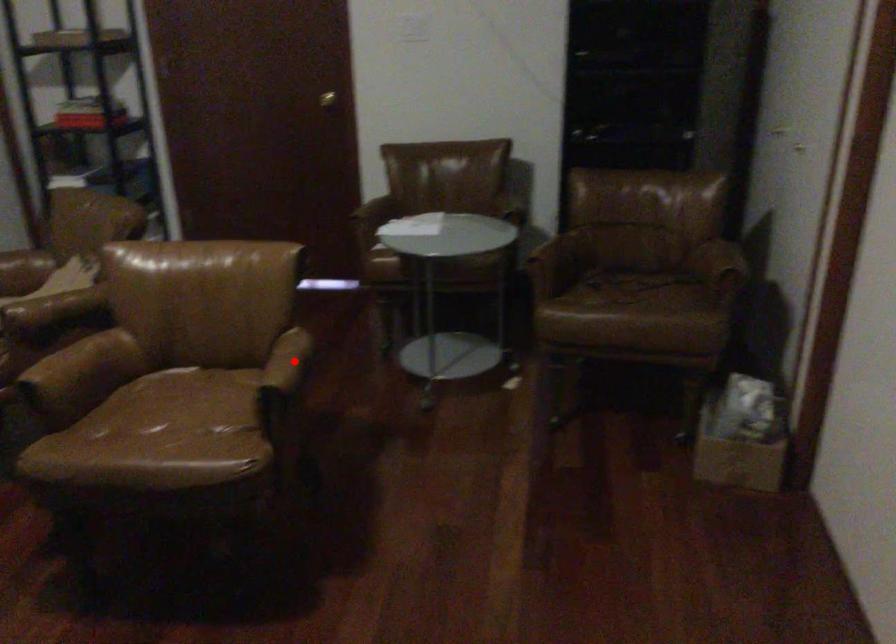
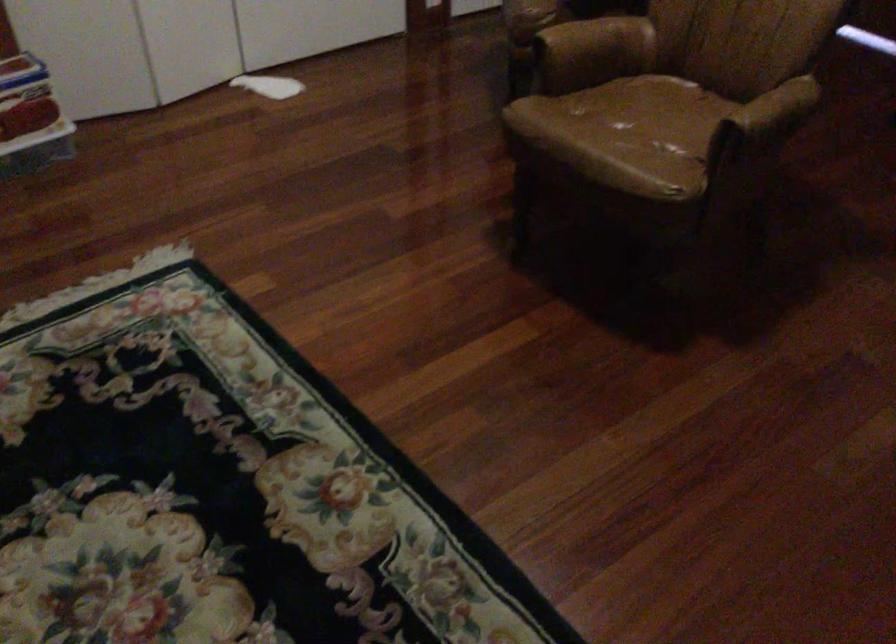
Find the pixel in the second image that matches the highlighted location in the first image.

(776, 109)